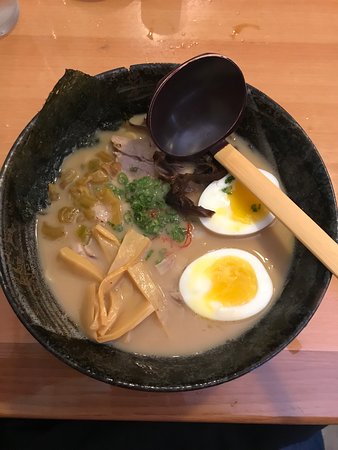
Find the location of `space under table`. space under table is located at coordinates (173, 441).